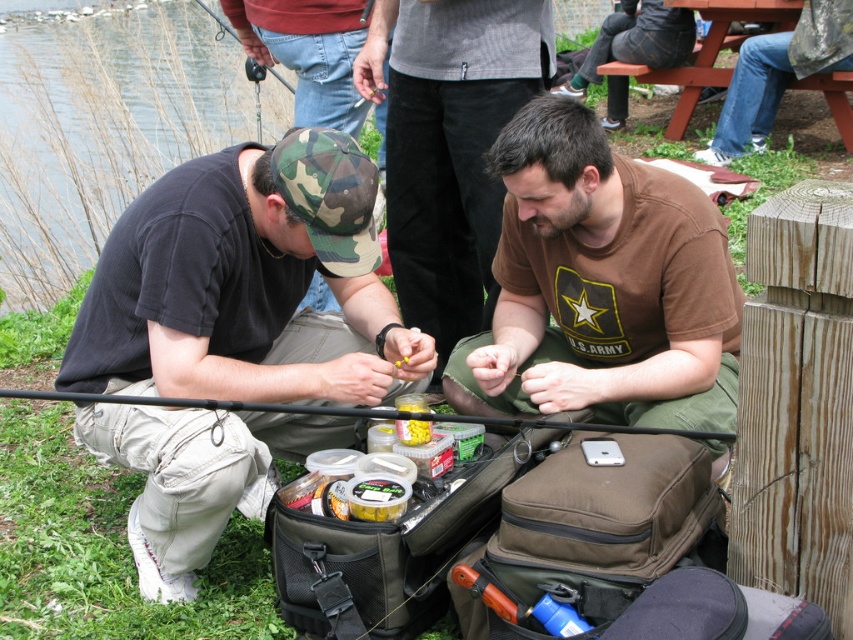
You are standing at the origin point of the coordinate system. The man in the brown cotton shirt at center is at position 0.447, 0.706. Can you determine if he is closer to the water compared to the other man?

The brown cotton shirt at center is located at point (601, 285). Since the coordinate system places the origin at the bottom left corner, the man in the brown cotton shirt at center is positioned further to the right and up, which typically indicates he is closer to the water than the other man.

From the picture: You are standing at the point labeled point [773,113] and want to walk to the point labeled point [426,429]. Which direction should you move to reach your destination?

You should move forward because point [773,113] is behind point [426,429], so moving forward from your current position will lead you directly towards the destination.

You are standing at the edge of the water and see the black matte fishing pole at center and the yellow plastic container at center. Which object is closer to your eye level?

The black matte fishing pole at center is located above the yellow plastic container at center, so it is closer to your eye level.